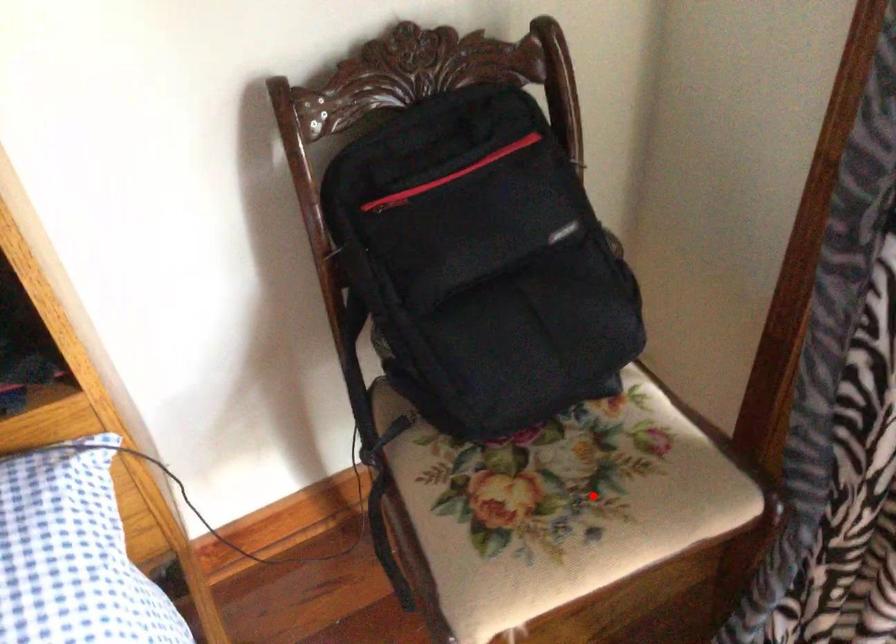
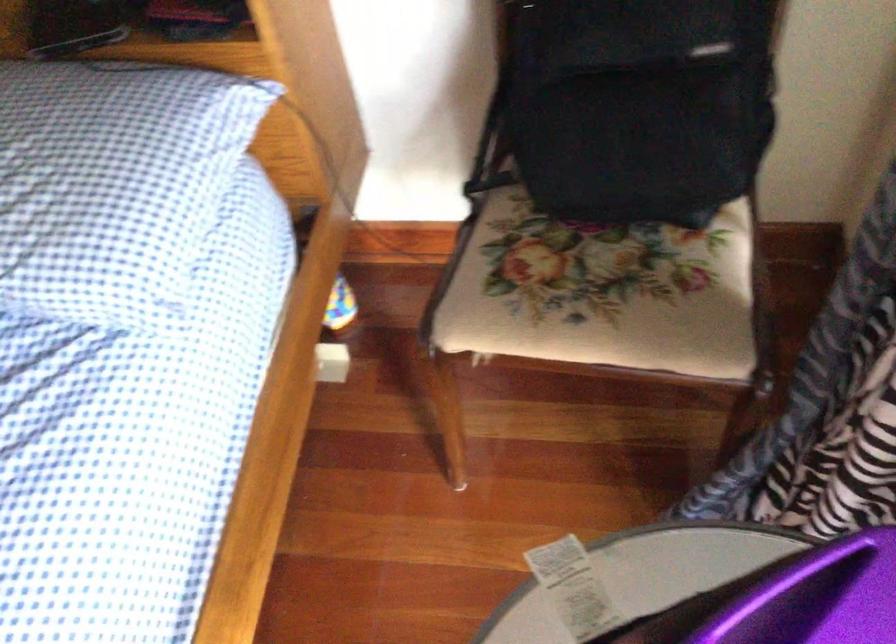
Find the pixel in the second image that matches the highlighted location in the first image.

(599, 292)